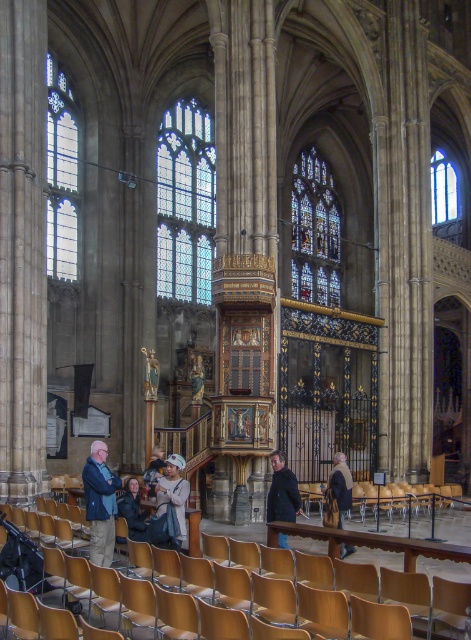
Does wooden polished chair at center have a lesser width compared to matte gray coat at lower center?

In fact, wooden polished chair at center might be wider than matte gray coat at lower center.

Does point (441, 596) come behind point (185, 493)?

No, it is not.

Image resolution: width=471 pixels, height=640 pixels. In order to click on wooden polished chair at center in this screenshot , I will do `click(316, 579)`.

Can you confirm if light brown leather jacket at lower left is smaller than dark blue fabric jacket at lower center?

No.

Where is `light brown leather jacket at lower left`? The height and width of the screenshot is (640, 471). light brown leather jacket at lower left is located at coordinates (99, 502).

What do you see at coordinates (173, 492) in the screenshot? Image resolution: width=471 pixels, height=640 pixels. I see `matte gray coat at lower center` at bounding box center [173, 492].

Does matte gray coat at lower center lie behind dark blue fabric jacket at lower center?

No, matte gray coat at lower center is in front of dark blue fabric jacket at lower center.

The width and height of the screenshot is (471, 640). In order to click on matte gray coat at lower center in this screenshot , I will do `click(173, 492)`.